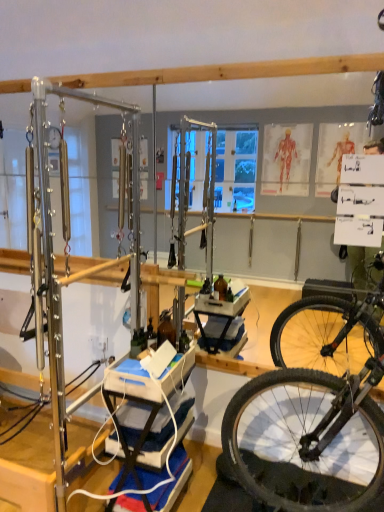
Question: Should I look upward or downward to see wooden table at center?

Choices:
 (A) up
 (B) down

Answer: (B)

Question: From a real-world perspective, is blue fabric yoga mat at lower center positioned under wooden table at center based on gravity?

Choices:
 (A) no
 (B) yes

Answer: (B)

Question: Does blue fabric yoga mat at lower center have a larger size compared to wooden table at center?

Choices:
 (A) yes
 (B) no

Answer: (B)

Question: From a real-world perspective, is blue fabric yoga mat at lower center positioned over wooden table at center based on gravity?

Choices:
 (A) yes
 (B) no

Answer: (B)

Question: Is blue fabric yoga mat at lower center closer to the viewer compared to wooden table at center?

Choices:
 (A) yes
 (B) no

Answer: (B)

Question: Is blue fabric yoga mat at lower center to the right of wooden table at center from the viewer's perspective?

Choices:
 (A) yes
 (B) no

Answer: (B)

Question: Considering the relative sizes of blue fabric yoga mat at lower center and wooden table at center in the image provided, is blue fabric yoga mat at lower center taller than wooden table at center?

Choices:
 (A) no
 (B) yes

Answer: (A)

Question: From a real-world perspective, is wooden table at center positioned over blue fabric yoga mat at lower center based on gravity?

Choices:
 (A) no
 (B) yes

Answer: (B)

Question: Is wooden table at center wider than blue fabric yoga mat at lower center?

Choices:
 (A) yes
 (B) no

Answer: (A)

Question: Can you confirm if wooden table at center is bigger than blue fabric yoga mat at lower center?

Choices:
 (A) yes
 (B) no

Answer: (A)

Question: Considering the relative sizes of wooden table at center and blue fabric yoga mat at lower center in the image provided, is wooden table at center taller than blue fabric yoga mat at lower center?

Choices:
 (A) yes
 (B) no

Answer: (A)

Question: Considering the relative positions of wooden table at center and blue fabric yoga mat at lower center in the image provided, is wooden table at center to the right of blue fabric yoga mat at lower center from the viewer's perspective?

Choices:
 (A) yes
 (B) no

Answer: (A)

Question: Is wooden table at center in front of blue fabric yoga mat at lower center?

Choices:
 (A) yes
 (B) no

Answer: (A)

Question: In terms of height, does blue fabric yoga mat at lower center look taller or shorter compared to wooden table at center?

Choices:
 (A) tall
 (B) short

Answer: (B)